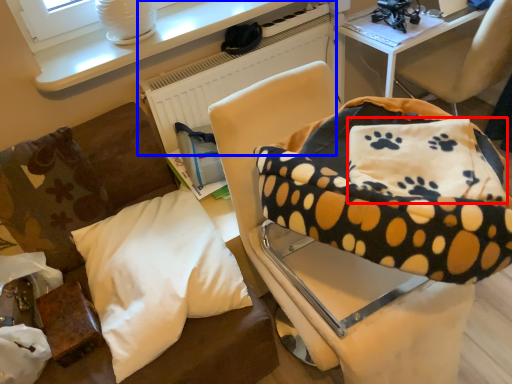
Question: Which of the following is the farthest to the observer, pillow (highlighted by a red box) or radiator (highlighted by a blue box)?

Choices:
 (A) pillow
 (B) radiator

Answer: (B)